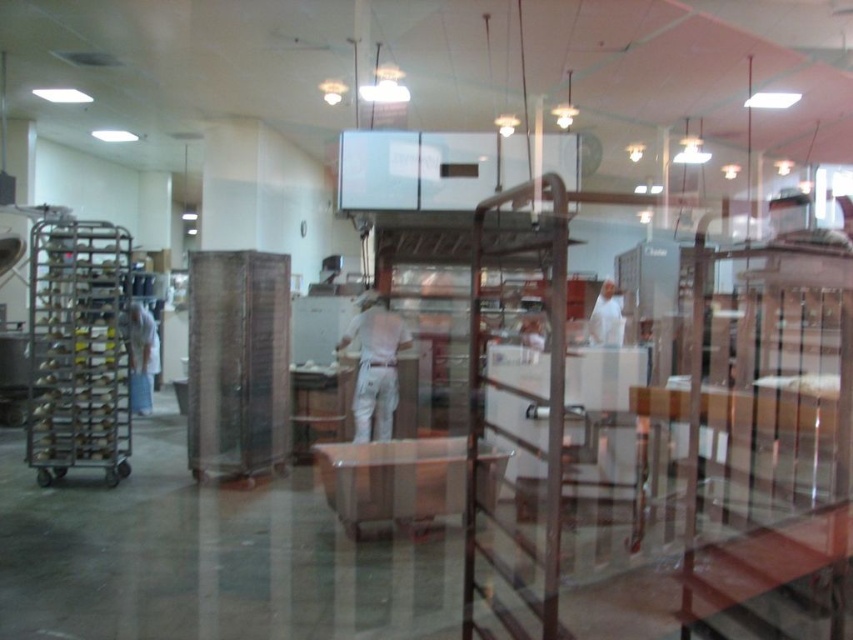
Between white fabric shirt at center and white fabric shirt at left, which one appears on the right side from the viewer's perspective?

Positioned to the right is white fabric shirt at center.

Is white fabric shirt at center taller than white fabric shirt at left?

No.

Image resolution: width=853 pixels, height=640 pixels. Identify the location of white fabric shirt at center. (375, 364).